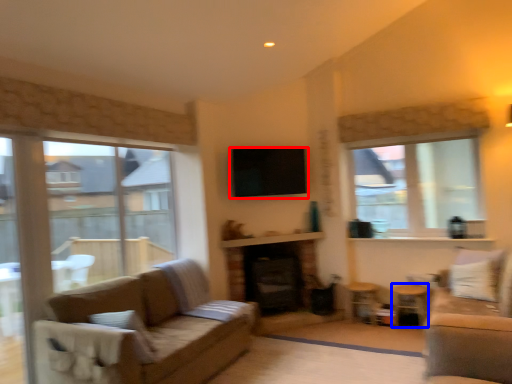
Question: Which object is further to the camera taking this photo, window screen (highlighted by a red box) or side table (highlighted by a blue box)?

Choices:
 (A) window screen
 (B) side table

Answer: (A)